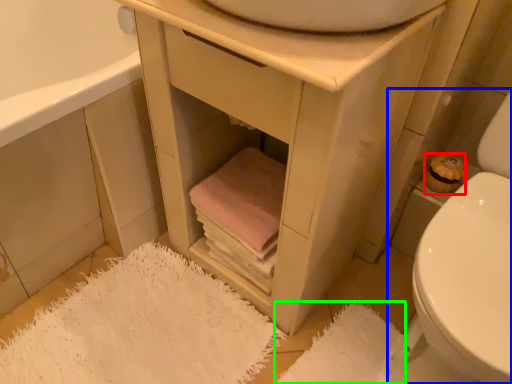
Question: Based on their relative distances, which object is farther from toilet paper (highlighted by a red box)? Choose from toilet (highlighted by a blue box) and bath mat (highlighted by a green box).

Choices:
 (A) toilet
 (B) bath mat

Answer: (B)